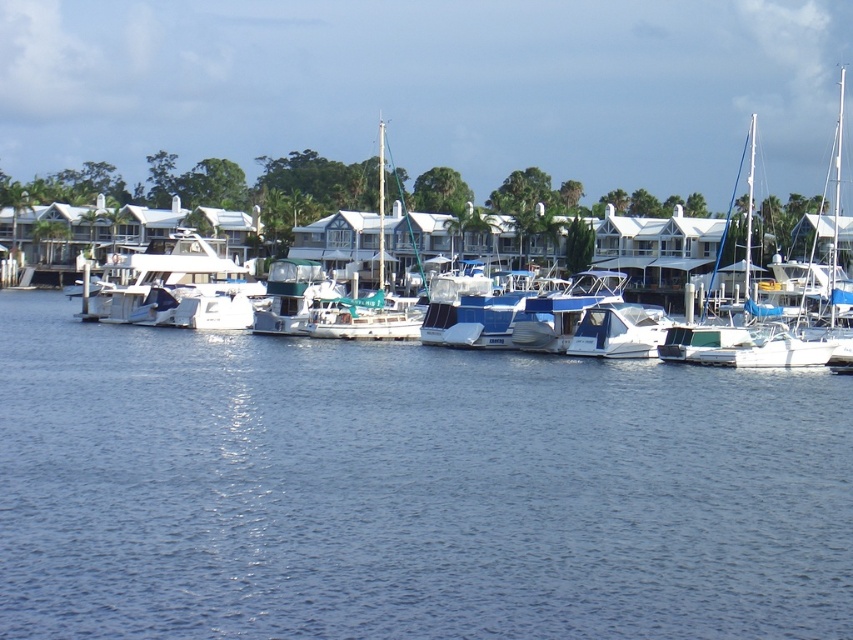
Is blue water at center positioned before white matte boat at center?

That is True.

Describe the element at coordinates (408, 490) in the screenshot. This screenshot has width=853, height=640. I see `blue water at center` at that location.

Locate an element on the screen. The height and width of the screenshot is (640, 853). blue water at center is located at coordinates (408, 490).